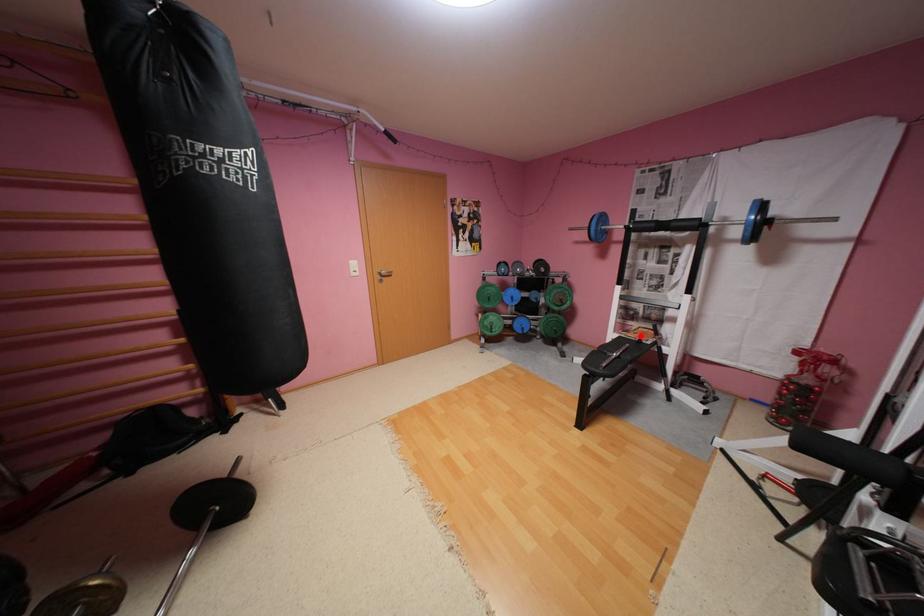
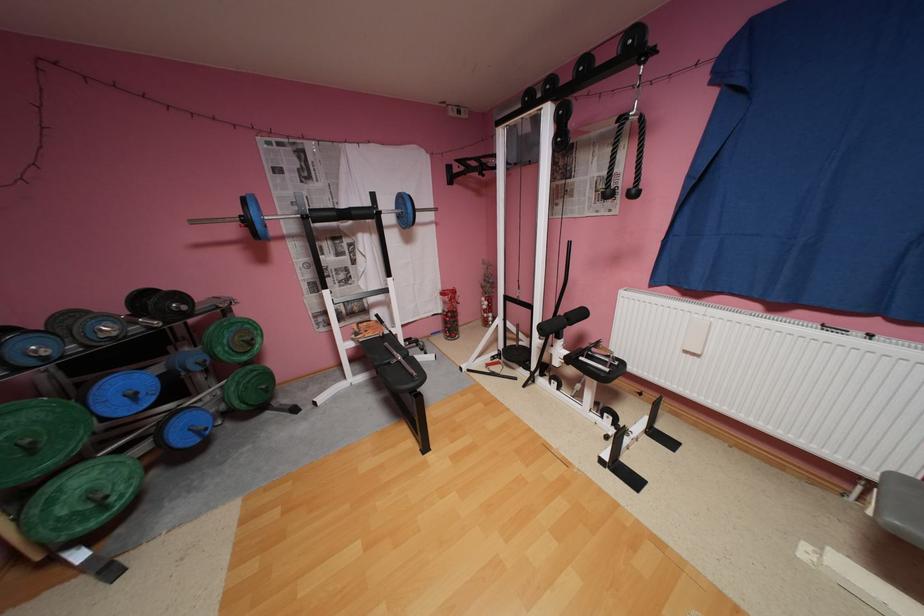
Where in the second image is the point corresponding to the highlighted location from the first image?

(380, 334)